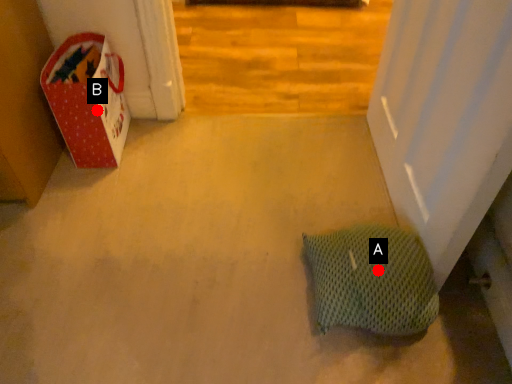
Question: Two points are circled on the image, labeled by A and B beside each circle. Among these points, which one is farthest from the camera?

Choices:
 (A) A is further
 (B) B is further

Answer: (B)